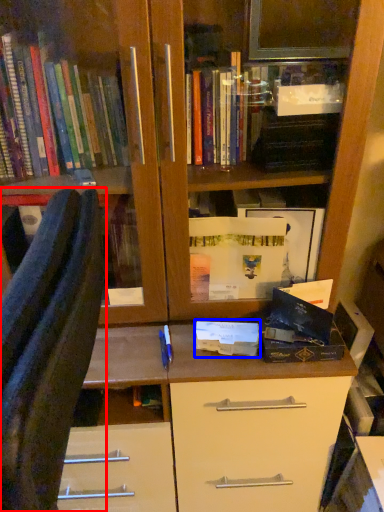
Question: Which of the following is the farthest to the observer, furniture (highlighted by a red box) or paperback book (highlighted by a blue box)?

Choices:
 (A) furniture
 (B) paperback book

Answer: (B)